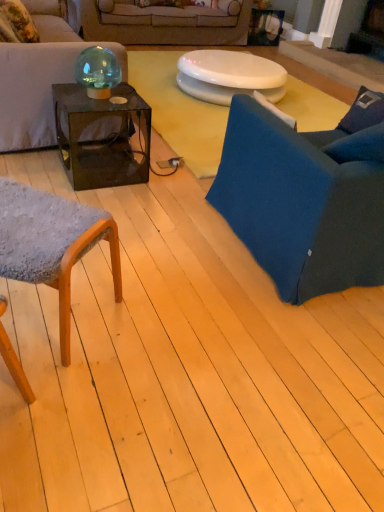
Question: Is matte black couch at upper left, placed as the first studio couch when sorted from front to back, bigger than white glossy toilet seat at center?

Choices:
 (A) yes
 (B) no

Answer: (A)

Question: Considering the relative sizes of matte black couch at upper left, placed as the first studio couch when sorted from front to back, and white glossy toilet seat at center in the image provided, is matte black couch at upper left, placed as the first studio couch when sorted from front to back, shorter than white glossy toilet seat at center?

Choices:
 (A) no
 (B) yes

Answer: (A)

Question: Is matte black couch at upper left, placed as the first studio couch when sorted from front to back, outside white glossy toilet seat at center?

Choices:
 (A) no
 (B) yes

Answer: (B)

Question: Is matte black couch at upper left, placed as the first studio couch when sorted from front to back, positioned before white glossy toilet seat at center?

Choices:
 (A) no
 (B) yes

Answer: (B)

Question: Is matte black couch at upper left, positioned as the second studio couch in back-to-front order, far away from white glossy toilet seat at center?

Choices:
 (A) no
 (B) yes

Answer: (B)

Question: Is teal glass sphere at upper left spatially inside white glossy toilet seat at center, or outside of it?

Choices:
 (A) outside
 (B) inside

Answer: (A)

Question: Based on their sizes in the image, would you say teal glass sphere at upper left is bigger or smaller than white glossy toilet seat at center?

Choices:
 (A) small
 (B) big

Answer: (A)

Question: From a real-world perspective, is teal glass sphere at upper left above or below white glossy toilet seat at center?

Choices:
 (A) below
 (B) above

Answer: (B)

Question: Based on their positions, is teal glass sphere at upper left located to the left or right of white glossy toilet seat at center?

Choices:
 (A) left
 (B) right

Answer: (A)

Question: Visually, is beige fabric couch at upper center, arranged as the first studio couch when viewed from the back, positioned to the left or to the right of blue fabric chair at right, the first chair positioned from the right?

Choices:
 (A) right
 (B) left

Answer: (B)

Question: Is point (104, 6) positioned closer to the camera than point (379, 228)?

Choices:
 (A) farther
 (B) closer

Answer: (A)

Question: Considering their positions, is beige fabric couch at upper center, positioned as the 2th studio couch in front-to-back order, located in front of or behind blue fabric chair at right, the first chair positioned from the right?

Choices:
 (A) behind
 (B) front

Answer: (A)

Question: From a real-world perspective, relative to blue fabric chair at right, the first chair positioned from the right, is beige fabric couch at upper center, positioned as the 2th studio couch in front-to-back order, vertically above or below?

Choices:
 (A) above
 (B) below

Answer: (B)

Question: Is point (86, 81) closer or farther from the camera than point (28, 233)?

Choices:
 (A) farther
 (B) closer

Answer: (A)

Question: From a real-world perspective, is teal glass sphere at upper left physically located above or below textured gray fabric chair at lower left, which is the 1th chair from left to right?

Choices:
 (A) above
 (B) below

Answer: (A)